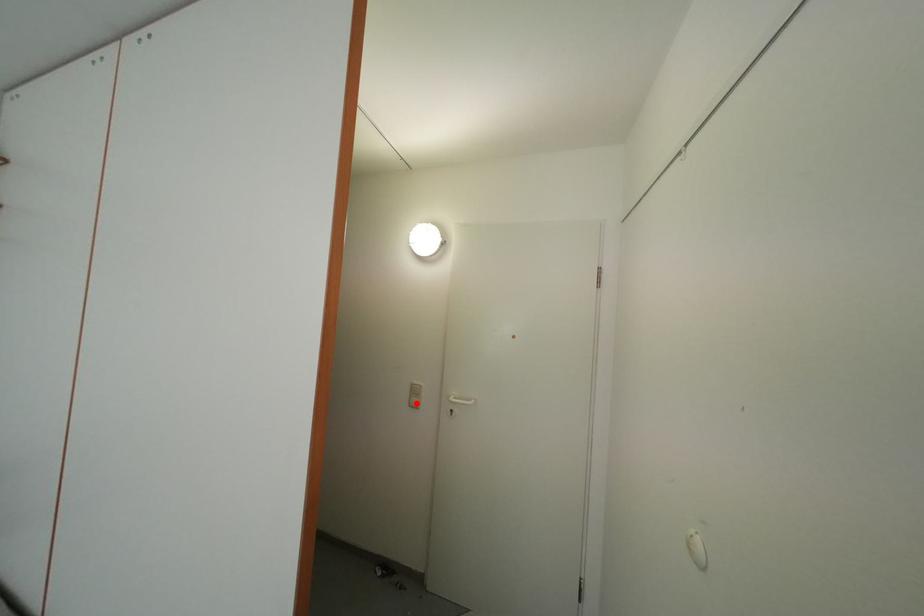
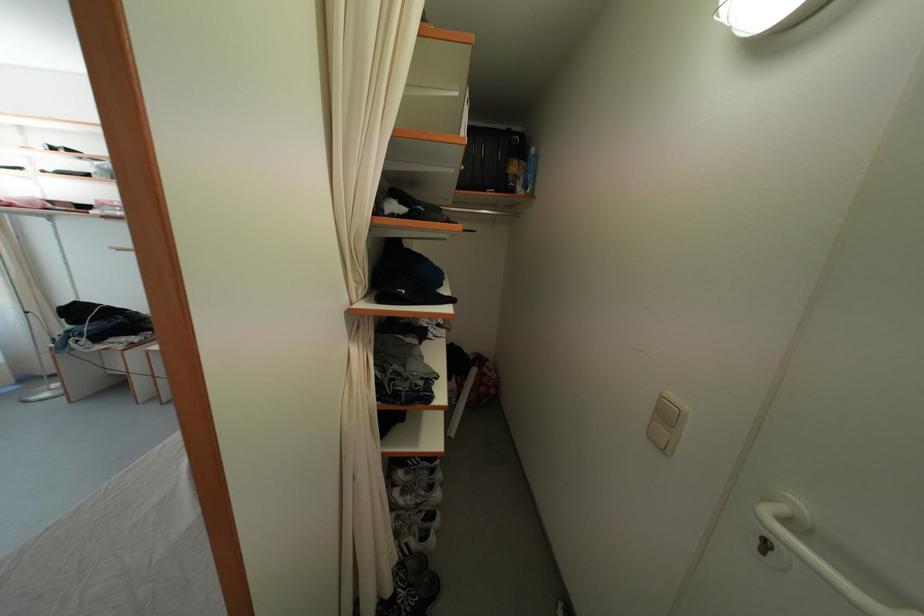
Where in the second image is the point corresponding to the highlighted location from the first image?

(659, 426)